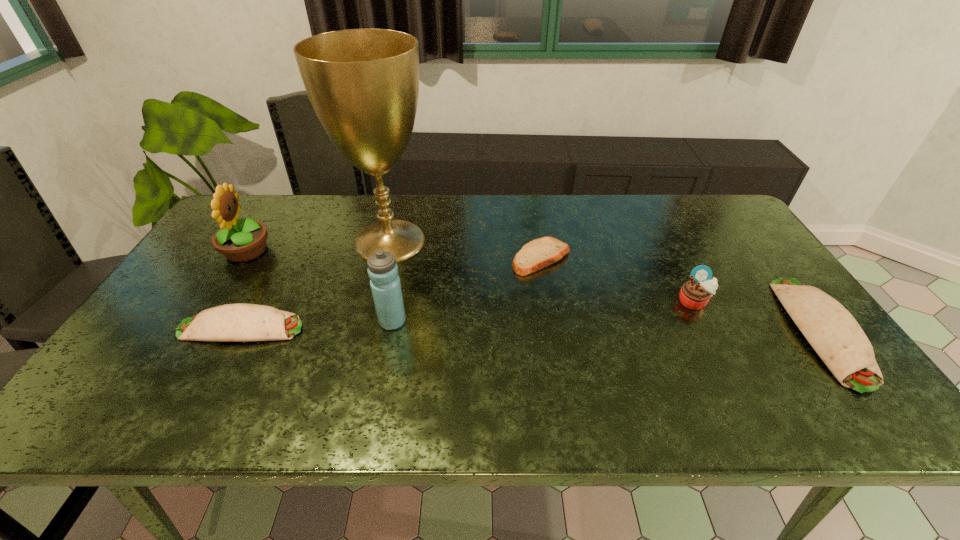
Locate which object ranks third in proximity to the shorter burrito. Please provide its 2D coordinates. Your answer should be formatted as a tuple, i.e. [(x, y)], where the tuple contains the x and y coordinates of a point satisfying the conditions above.

[(382, 269)]

At what (x,y) coordinates should I click in order to perform the action: click on free location that satisfies the following two spatial constraints: 1. on the face of the sunflower; 2. on the right side of the shortest object. Please return your answer as a coordinate pair (x, y). Looking at the image, I should click on (242, 258).

Find the location of a particular element. free region that satisfies the following two spatial constraints: 1. on the front side of the pita bread; 2. on the left side of the tallest object is located at coordinates (385, 258).